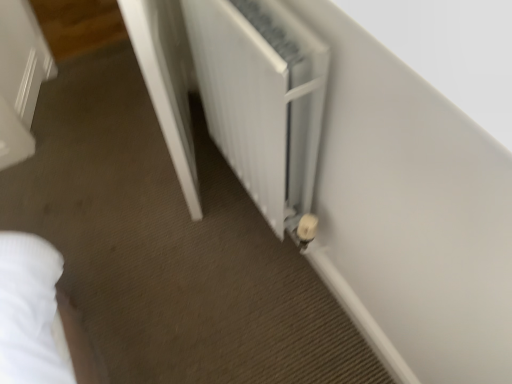
This screenshot has height=384, width=512. I want to click on white matte radiator at center, so click(262, 98).

This screenshot has height=384, width=512. What do you see at coordinates (262, 98) in the screenshot? I see `white matte radiator at center` at bounding box center [262, 98].

The height and width of the screenshot is (384, 512). What do you see at coordinates (167, 82) in the screenshot?
I see `white glossy door at center` at bounding box center [167, 82].

Where is `white glossy door at center`? The height and width of the screenshot is (384, 512). white glossy door at center is located at coordinates (167, 82).

Measure the distance between point (164, 44) and camera.

Point (164, 44) and camera are 5.40 feet apart.

This screenshot has width=512, height=384. I want to click on white matte radiator at center, so click(262, 98).

Does white matte radiator at center appear on the right side of white glossy door at center?

Correct, you'll find white matte radiator at center to the right of white glossy door at center.

Is the depth of white matte radiator at center less than that of white glossy door at center?

Yes, it is.

Is point (203, 21) positioned in front of point (181, 27)?

That is True.

From the image's perspective, does white matte radiator at center appear higher than white glossy door at center?

Actually, white matte radiator at center appears below white glossy door at center in the image.

From a real-world perspective, is white matte radiator at center positioned above or below white glossy door at center?

white matte radiator at center is above white glossy door at center.

Can you confirm if white matte radiator at center is wider than white glossy door at center?

Indeed, white matte radiator at center has a greater width compared to white glossy door at center.

Looking at this image, who is taller, white matte radiator at center or white glossy door at center?

white glossy door at center is taller.

Is white matte radiator at center smaller than white glossy door at center?

Correct, white matte radiator at center occupies less space than white glossy door at center.

From the picture: Is white matte radiator at center situated inside white glossy door at center or outside?

The correct answer is: outside.

From the picture: Is white matte radiator at center positioned far away from white glossy door at center?

No, white matte radiator at center is not far from white glossy door at center.

Could you tell me if white matte radiator at center is turned towards white glossy door at center?

No, white matte radiator at center is not turned towards white glossy door at center.

Can you tell me how much white matte radiator at center and white glossy door at center differ in facing direction?

19.3 degrees.

How much distance is there between white matte radiator at center and white glossy door at center?

white matte radiator at center is 9.39 inches from white glossy door at center.

Where is `screen door behind the white matte radiator at center`? This screenshot has width=512, height=384. screen door behind the white matte radiator at center is located at coordinates (167, 82).

Considering the relative positions of white glossy door at center and white matte radiator at center in the image provided, is white glossy door at center to the left or to the right of white matte radiator at center?

From the image, it's evident that white glossy door at center is to the left of white matte radiator at center.

Which is in front, white glossy door at center or white matte radiator at center?

white matte radiator at center.

Considering the positions of point (177, 32) and point (209, 60), is point (177, 32) closer or farther from the camera than point (209, 60)?

Point (177, 32).

Looking at this image, from the image's perspective, would you say white glossy door at center is positioned over white matte radiator at center?

Yes, from the image's perspective, white glossy door at center is on top of white matte radiator at center.

From a real-world perspective, relative to white matte radiator at center, is white glossy door at center vertically above or below?

In terms of real-world spatial position, white glossy door at center is below white matte radiator at center.

Considering the relative sizes of white glossy door at center and white matte radiator at center in the image provided, is white glossy door at center thinner than white matte radiator at center?

Yes, white glossy door at center is thinner than white matte radiator at center.

Can you confirm if white glossy door at center is shorter than white matte radiator at center?

Incorrect, the height of white glossy door at center does not fall short of that of white matte radiator at center.

In terms of size, does white glossy door at center appear bigger or smaller than white matte radiator at center?

Considering their sizes, white glossy door at center takes up more space than white matte radiator at center.

Is white glossy door at center not inside white matte radiator at center?

That's correct, white glossy door at center is outside of white matte radiator at center.

Is the surface of white glossy door at center in direct contact with white matte radiator at center?

No, white glossy door at center is not touching white matte radiator at center.

Is white glossy door at center positioned with its back to white matte radiator at center?

Correct, white glossy door at center is looking away from white matte radiator at center.

How different are the orientations of white glossy door at center and white matte radiator at center in degrees?

The angular difference between white glossy door at center and white matte radiator at center is 19.3 degrees.

Locate an element on the screen. The height and width of the screenshot is (384, 512). radiator positioned vertically above the white glossy door at center (from a real-world perspective) is located at coordinates (262, 98).

The width and height of the screenshot is (512, 384). Identify the location of radiator that is above the white glossy door at center (from a real-world perspective). (262, 98).

In the image, there is a white matte radiator at center. Find the location of `screen door below it (from a real-world perspective)`. screen door below it (from a real-world perspective) is located at coordinates [167, 82].